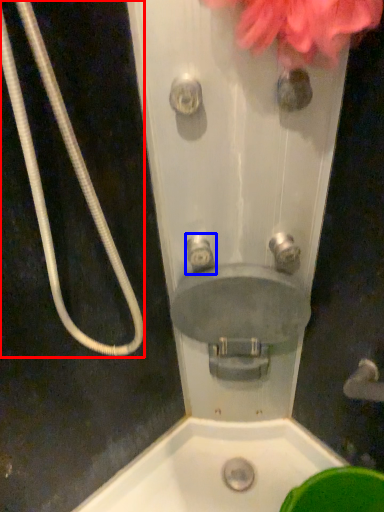
Question: Among these objects, which one is nearest to the camera, garden hose (highlighted by a red box) or plumbing fixture (highlighted by a blue box)?

Choices:
 (A) garden hose
 (B) plumbing fixture

Answer: (A)